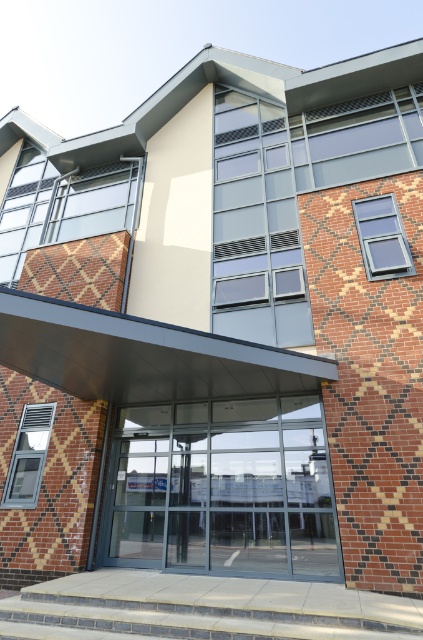
Measure the distance between point (x=129, y=506) and camera.

A distance of 7.35 meters exists between point (x=129, y=506) and camera.

Who is shorter, transparent glass door at center or gray concrete stairs at lower center?

With less height is gray concrete stairs at lower center.

Locate an element on the screen. Image resolution: width=423 pixels, height=640 pixels. transparent glass door at center is located at coordinates (220, 488).